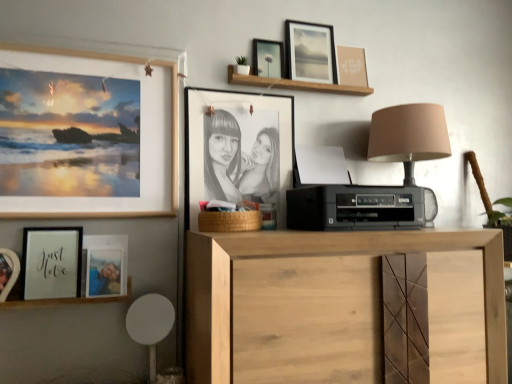
Describe the element at coordinates (267, 58) in the screenshot. The image size is (512, 384). I see `matte black frame at upper center, which is counted as the 6th picture frame, starting from the left` at that location.

Where is `black plastic printer at center`? The height and width of the screenshot is (384, 512). black plastic printer at center is located at coordinates (355, 207).

This screenshot has height=384, width=512. What do you see at coordinates (294, 84) in the screenshot?
I see `wooden shelf at upper center, positioned as the 2th shelf in left-to-right order` at bounding box center [294, 84].

This screenshot has width=512, height=384. What do you see at coordinates (51, 262) in the screenshot?
I see `matte black frame at lower left, which ranks as the seventh picture frame in right-to-left order` at bounding box center [51, 262].

Measure the distance between point (54,256) and camera.

Point (54,256) and camera are 4.29 feet apart.

In order to face matte brown picture frame at upper center, the eighth picture frame when ordered from left to right, should I rotate leftwards or rightwards?

It's best to rotate right around 12.532 degrees.

I want to click on matte black photo frame at center, acting as the fifth picture frame starting from the left, so click(x=237, y=149).

This screenshot has height=384, width=512. What do you see at coordinates (237, 149) in the screenshot?
I see `matte black photo frame at center, acting as the fifth picture frame starting from the left` at bounding box center [237, 149].

I want to click on matte black frame at upper center, the 3th picture frame viewed from the right, so click(x=267, y=58).

This screenshot has height=384, width=512. Identify the location of the 5th picture frame counting from the right side of the matte black frame at lower left, acting as the 2th picture frame starting from the left. (310, 52).

Would you say matte black frame at lower left, acting as the 2th picture frame starting from the left, is outside matte black picture frame at upper center, arranged as the second picture frame when viewed from the right?

Yes, matte black frame at lower left, acting as the 2th picture frame starting from the left, is located beyond the bounds of matte black picture frame at upper center, arranged as the second picture frame when viewed from the right.

Considering the sizes of matte black frame at lower left, which ranks as the seventh picture frame in right-to-left order, and matte black picture frame at upper center, arranged as the second picture frame when viewed from the right, in the image, is matte black frame at lower left, which ranks as the seventh picture frame in right-to-left order, wider or thinner than matte black picture frame at upper center, arranged as the second picture frame when viewed from the right,?

matte black frame at lower left, which ranks as the seventh picture frame in right-to-left order, is wider than matte black picture frame at upper center, arranged as the second picture frame when viewed from the right.

Does matte brown picture frame at upper center, which appears as the 1th picture frame when viewed from the right, have a smaller size compared to matte black picture frame at upper center, which is counted as the seventh picture frame, starting from the left?

Yes, matte brown picture frame at upper center, which appears as the 1th picture frame when viewed from the right, is smaller than matte black picture frame at upper center, which is counted as the seventh picture frame, starting from the left.

Which of these two, matte brown picture frame at upper center, which appears as the 1th picture frame when viewed from the right, or matte black picture frame at upper center, which is counted as the seventh picture frame, starting from the left, stands taller?

With more height is matte black picture frame at upper center, which is counted as the seventh picture frame, starting from the left.

Is matte brown picture frame at upper center, the eighth picture frame when ordered from left to right, in contact with matte black picture frame at upper center, which is counted as the seventh picture frame, starting from the left?

No, matte brown picture frame at upper center, the eighth picture frame when ordered from left to right, is not touching matte black picture frame at upper center, which is counted as the seventh picture frame, starting from the left.

Which object is further away from the camera taking this photo, matte brown picture frame at upper center, which appears as the 1th picture frame when viewed from the right, or matte black picture frame at upper center, which is counted as the seventh picture frame, starting from the left?

Positioned behind is matte brown picture frame at upper center, which appears as the 1th picture frame when viewed from the right.

In terms of height, does wooden frame at lower left, which appears as the 2th shelf when viewed from the back, look taller or shorter compared to matte black picture frame at lower left, which is the 8th picture frame from right to left?

Clearly, wooden frame at lower left, which appears as the 2th shelf when viewed from the back, is shorter compared to matte black picture frame at lower left, which is the 8th picture frame from right to left.

Measure the distance from wooden frame at lower left, which ranks as the 1th shelf in left-to-right order, to matte black picture frame at lower left, which is the 8th picture frame from right to left.

They are 5.46 inches apart.

Would you say wooden frame at lower left, which ranks as the 1th shelf in left-to-right order, is a long distance from matte black picture frame at lower left, the 1th picture frame positioned from the left?

That's not correct — wooden frame at lower left, which ranks as the 1th shelf in left-to-right order, is a little close to matte black picture frame at lower left, the 1th picture frame positioned from the left.

Is the position of wooden frame at lower left, which ranks as the 1th shelf in left-to-right order, less distant than that of matte black picture frame at lower left, which is the 8th picture frame from right to left?

No, it is behind matte black picture frame at lower left, which is the 8th picture frame from right to left.

Which is more to the right, wooden shelf at upper center, the second shelf viewed from the front, or matte black photo frame at center, which ranks as the 4th picture frame in right-to-left order?

From the viewer's perspective, wooden shelf at upper center, the second shelf viewed from the front, appears more on the right side.

From a real-world perspective, is wooden shelf at upper center, which ranks as the 1th shelf in top-to-bottom order, on top of matte black photo frame at center, which ranks as the 4th picture frame in right-to-left order?

Yes.

Can you tell me how much wooden shelf at upper center, acting as the 2th shelf starting from the bottom, and matte black photo frame at center, acting as the fifth picture frame starting from the left, differ in facing direction?

The angular difference between wooden shelf at upper center, acting as the 2th shelf starting from the bottom, and matte black photo frame at center, acting as the fifth picture frame starting from the left, is 2.31 degrees.

Considering the relative sizes of wooden shelf at upper center, the second shelf viewed from the front, and matte black photo frame at center, which ranks as the 4th picture frame in right-to-left order, in the image provided, is wooden shelf at upper center, the second shelf viewed from the front, shorter than matte black photo frame at center, which ranks as the 4th picture frame in right-to-left order,?

Yes.

Does point (273, 56) appear closer or farther from the camera than point (348, 84)?

Point (273, 56) is positioned closer to the camera compared to point (348, 84).

Looking at the image, does matte black frame at upper center, which is counted as the 6th picture frame, starting from the left, seem bigger or smaller compared to matte brown picture frame at upper center, which appears as the 1th picture frame when viewed from the right?

In the image, matte black frame at upper center, which is counted as the 6th picture frame, starting from the left, appears to be larger than matte brown picture frame at upper center, which appears as the 1th picture frame when viewed from the right.

From a real-world perspective, is matte black frame at upper center, which is counted as the 6th picture frame, starting from the left, physically below matte brown picture frame at upper center, which appears as the 1th picture frame when viewed from the right?

Yes.

Is matte black frame at upper center, which is counted as the 6th picture frame, starting from the left, far away from matte brown picture frame at upper center, which appears as the 1th picture frame when viewed from the right?

No, there isn't a large distance between matte black frame at upper center, which is counted as the 6th picture frame, starting from the left, and matte brown picture frame at upper center, which appears as the 1th picture frame when viewed from the right.

What's the angular difference between matte beige lampshade at upper right and matte brown picture frame at upper center, the eighth picture frame when ordered from left to right,'s facing directions?

1.67 degrees separate the facing orientations of matte beige lampshade at upper right and matte brown picture frame at upper center, the eighth picture frame when ordered from left to right.

Is matte beige lampshade at upper right facing away from matte brown picture frame at upper center, the eighth picture frame when ordered from left to right?

No, matte beige lampshade at upper right's orientation is not away from matte brown picture frame at upper center, the eighth picture frame when ordered from left to right.

Which is behind, matte beige lampshade at upper right or matte brown picture frame at upper center, which appears as the 1th picture frame when viewed from the right?

Positioned behind is matte brown picture frame at upper center, which appears as the 1th picture frame when viewed from the right.

From a real-world perspective, is matte beige lampshade at upper right on top of matte brown picture frame at upper center, which appears as the 1th picture frame when viewed from the right?

Actually, matte beige lampshade at upper right is physically below matte brown picture frame at upper center, which appears as the 1th picture frame when viewed from the right, in the real world.

Based on the photo, is matte wooden photo frame at lower left, positioned as the fourth picture frame in left-to-right order, not near wooden picture frame at upper left, which ranks as the 6th picture frame in right-to-left order?

No.

How distant is matte wooden photo frame at lower left, positioned as the fourth picture frame in left-to-right order, from wooden picture frame at upper left, placed as the 3th picture frame when sorted from left to right?

They are 9.77 inches apart.

Which is more to the left, matte wooden photo frame at lower left, positioned as the fourth picture frame in left-to-right order, or wooden picture frame at upper left, placed as the 3th picture frame when sorted from left to right?

wooden picture frame at upper left, placed as the 3th picture frame when sorted from left to right.

Is matte wooden photo frame at lower left, positioned as the fourth picture frame in left-to-right order, turned away from wooden picture frame at upper left, which ranks as the 6th picture frame in right-to-left order?

No, matte wooden photo frame at lower left, positioned as the fourth picture frame in left-to-right order, is not facing the opposite direction of wooden picture frame at upper left, which ranks as the 6th picture frame in right-to-left order.

Starting from the matte black frame at lower left, acting as the 2th picture frame starting from the left, which picture frame is the 4th one behind? Please provide its 2D coordinates.

[(310, 52)]

Find the location of a particular element. Image resolution: width=512 pixels, height=384 pixels. the 2nd picture frame positioned above the matte brown picture frame at upper center, the eighth picture frame when ordered from left to right (from the image's perspective) is located at coordinates (310, 52).

Based on their spatial positions, is matte black picture frame at upper center, which is counted as the seventh picture frame, starting from the left, or matte black frame at lower left, which ranks as the seventh picture frame in right-to-left order, closer to wooden frame at lower left, which appears as the 2th shelf when viewed from the back?

Among the two, matte black frame at lower left, which ranks as the seventh picture frame in right-to-left order, is located nearer to wooden frame at lower left, which appears as the 2th shelf when viewed from the back.

Based on their spatial positions, is matte black picture frame at lower left, which is the 8th picture frame from right to left, or black plastic printer at center further from white plastic swivel chair at lower left?

black plastic printer at center is positioned further to the anchor white plastic swivel chair at lower left.

Considering their positions, is matte black frame at upper center, which is counted as the 6th picture frame, starting from the left, positioned further to matte beige lampshade at upper right than matte brown picture frame at upper center, which appears as the 1th picture frame when viewed from the right?

matte black frame at upper center, which is counted as the 6th picture frame, starting from the left, is positioned further to the anchor matte beige lampshade at upper right.

From the image, which object appears to be nearer to wooden shelf at upper center, the second shelf viewed from the front, wooden picture frame at upper left, which ranks as the 6th picture frame in right-to-left order, or natural wood cabinet at center?

wooden picture frame at upper left, which ranks as the 6th picture frame in right-to-left order, lies closer to wooden shelf at upper center, the second shelf viewed from the front, than the other object.

When comparing their distances from matte wooden photo frame at lower left, arranged as the fifth picture frame when viewed from the right, does matte black picture frame at upper center, arranged as the second picture frame when viewed from the right, or matte brown picture frame at upper center, which appears as the 1th picture frame when viewed from the right, seem further?

Among the two, matte brown picture frame at upper center, which appears as the 1th picture frame when viewed from the right, is located further to matte wooden photo frame at lower left, arranged as the fifth picture frame when viewed from the right.

From the image, which object appears to be farther from wooden frame at lower left, marked as the first shelf in a front-to-back arrangement, matte black picture frame at lower left, the 1th picture frame positioned from the left, or matte black photo frame at center, acting as the fifth picture frame starting from the left?

matte black photo frame at center, acting as the fifth picture frame starting from the left, lies further to wooden frame at lower left, marked as the first shelf in a front-to-back arrangement, than the other object.

Which object lies further to the anchor point matte beige lampshade at upper right, natural wood cabinet at center or white plastic swivel chair at lower left?

white plastic swivel chair at lower left is further to matte beige lampshade at upper right.

Which object lies further to the anchor point wooden shelf at upper center, marked as the first shelf in a right-to-left arrangement, matte black frame at upper center, the 3th picture frame viewed from the right, or matte black picture frame at upper center, which is counted as the seventh picture frame, starting from the left?

Based on the image, matte black picture frame at upper center, which is counted as the seventh picture frame, starting from the left, appears to be further to wooden shelf at upper center, marked as the first shelf in a right-to-left arrangement.

The image size is (512, 384). Identify the location of cabinetry situated between matte wooden photo frame at lower left, positioned as the fourth picture frame in left-to-right order, and matte beige lampshade at upper right from left to right. pos(346,307).

Locate an element on the screen. Image resolution: width=512 pixels, height=384 pixels. swivel chair situated between matte black frame at lower left, acting as the 2th picture frame starting from the left, and matte beige lampshade at upper right from left to right is located at coordinates (150, 324).

This screenshot has height=384, width=512. In order to click on shelf between matte black picture frame at lower left, which is the 8th picture frame from right to left, and matte wooden photo frame at lower left, positioned as the fourth picture frame in left-to-right order, from left to right in this screenshot , I will do `click(68, 300)`.

Locate an element on the screen. shelf situated between matte black frame at upper center, the 3th picture frame viewed from the right, and matte black picture frame at upper center, arranged as the second picture frame when viewed from the right, from left to right is located at coordinates (294, 84).